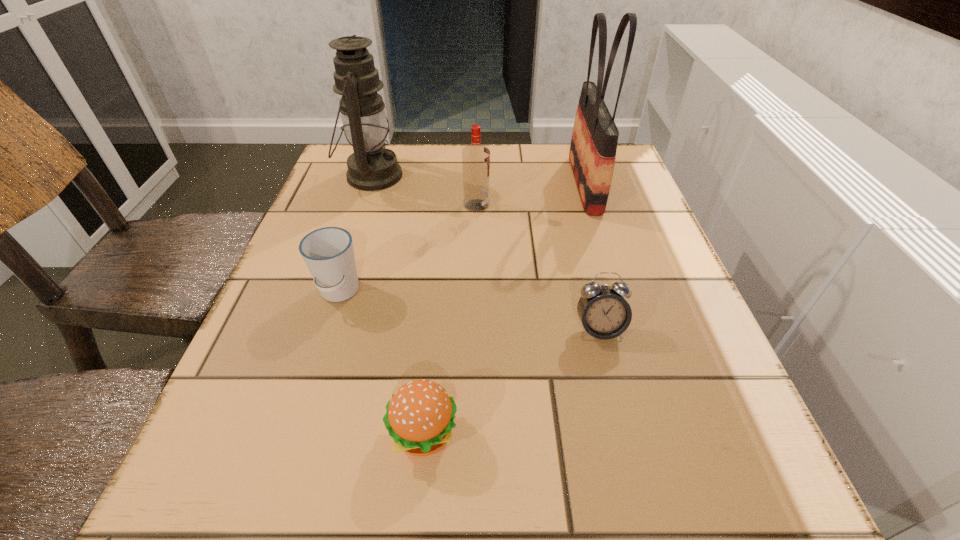
Identify the location of shopping bag that is at the right edge. (593, 147).

In order to click on alarm clock that is at the right edge in this screenshot , I will do `click(603, 311)`.

At what (x,y) coordinates should I click in order to perform the action: click on object located at the far left corner. Please return your answer as a coordinate pair (x, y). The width and height of the screenshot is (960, 540). Looking at the image, I should click on (372, 167).

I want to click on object at the far right corner, so click(x=593, y=147).

Find the location of `vacant space at the far edge of the desktop`. vacant space at the far edge of the desktop is located at coordinates (561, 168).

Find the location of a particular element. Image resolution: width=960 pixels, height=540 pixels. vacant space at the near edge of the desktop is located at coordinates (494, 516).

The width and height of the screenshot is (960, 540). In order to click on vacant space at the left edge in this screenshot , I will do (305, 373).

Image resolution: width=960 pixels, height=540 pixels. In order to click on free space at the right edge of the desktop in this screenshot , I will do `click(660, 367)`.

Identify the location of vacant region at the near left corner of the desktop. The image size is (960, 540). (282, 470).

The height and width of the screenshot is (540, 960). I want to click on free space at the near right corner, so click(746, 521).